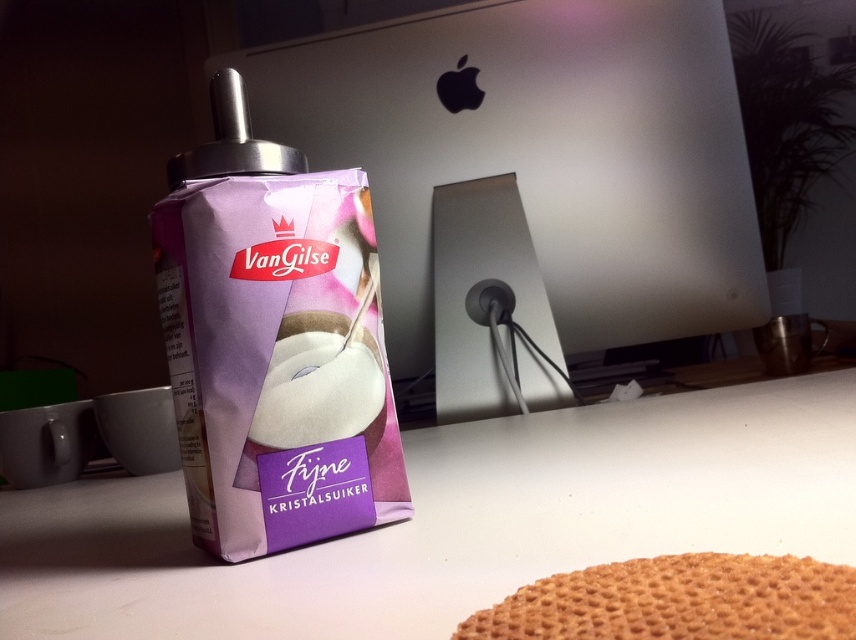
Question: In this image, where is white matte table at center located relative to golden textured wafer at lower right?

Choices:
 (A) left
 (B) right

Answer: (A)

Question: Among these points, which one is farthest from the camera?

Choices:
 (A) (729, 566)
 (B) (61, 595)

Answer: (B)

Question: Can you confirm if white matte table at center is thinner than golden textured wafer at lower right?

Choices:
 (A) yes
 (B) no

Answer: (B)

Question: Does white matte table at center have a smaller size compared to golden textured wafer at lower right?

Choices:
 (A) no
 (B) yes

Answer: (A)

Question: Which point is farther to the camera?

Choices:
 (A) golden textured wafer at lower right
 (B) white matte table at center

Answer: (B)